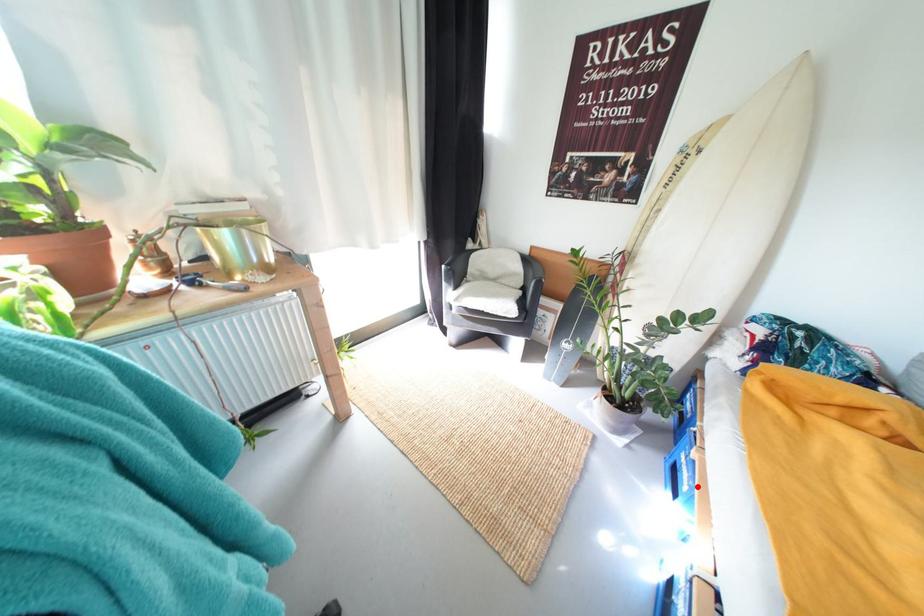
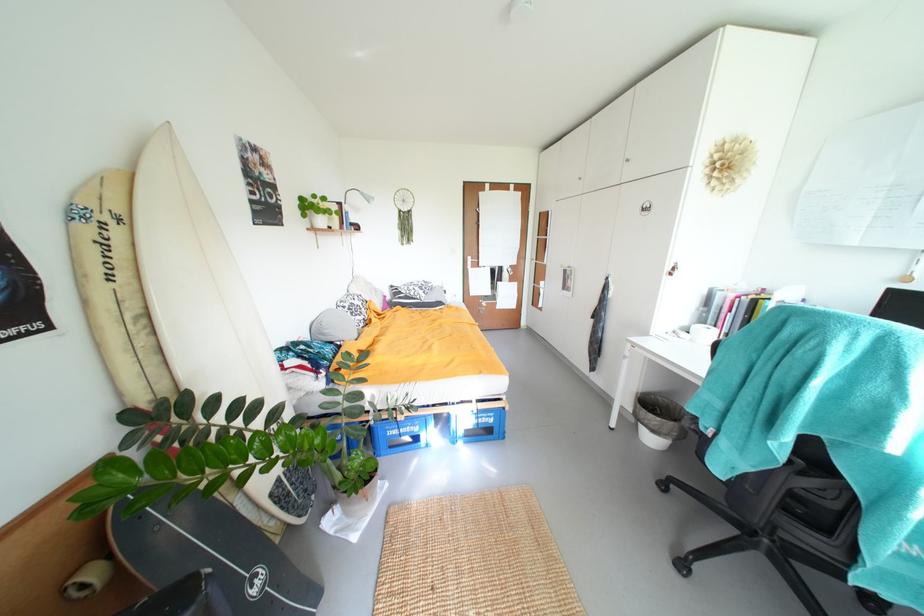
Locate, in the second image, the point that corresponds to the highlighted location in the first image.

(423, 428)